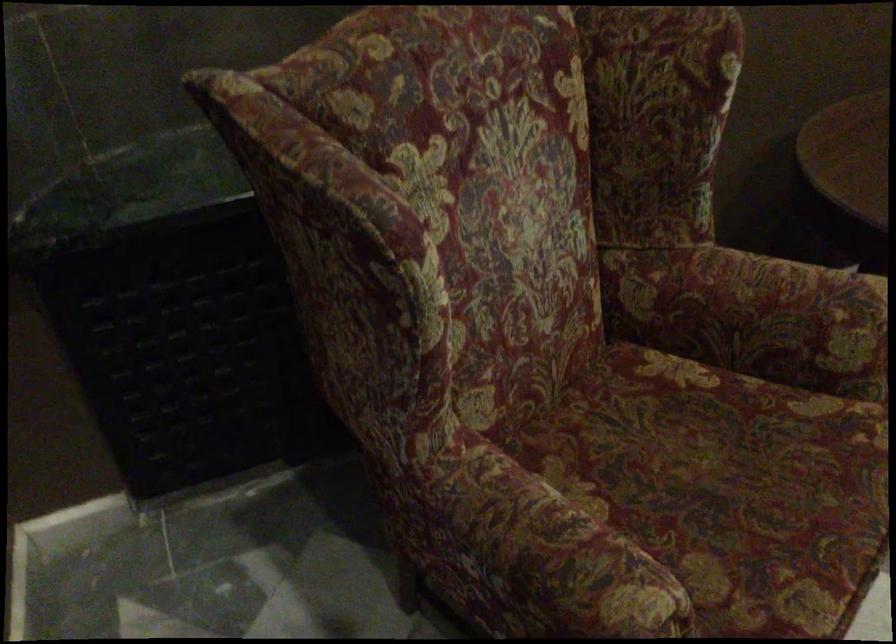
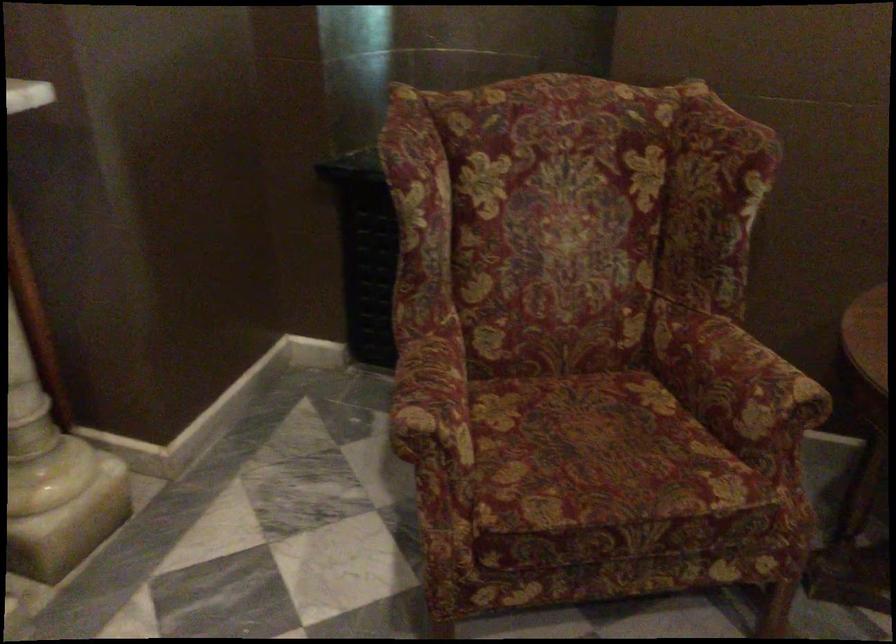
Question: The camera is either moving clockwise (left) or counter-clockwise (right) around the object. The first image is from the beginning of the video and the second image is from the end. Is the camera moving left or right when shooting the video?

Choices:
 (A) Left
 (B) Right

Answer: (B)